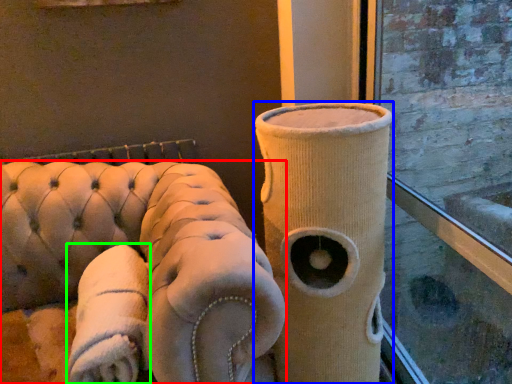
Question: Which is farther away from furniture (highlighted by a red box)? vase (highlighted by a blue box) or cloth (highlighted by a green box)?

Choices:
 (A) vase
 (B) cloth

Answer: (A)